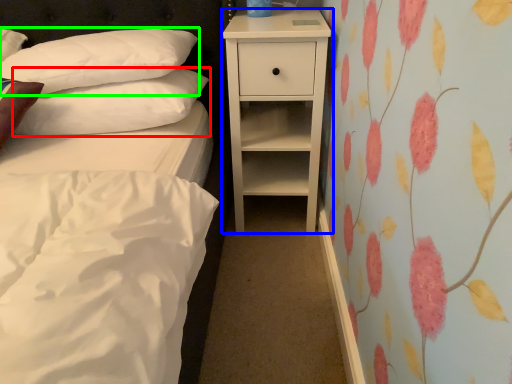
Question: Estimate the real-world distances between objects in this image. Which object is farther from pillow (highlighted by a red box), nightstand (highlighted by a blue box) or pillow (highlighted by a green box)?

Choices:
 (A) nightstand
 (B) pillow

Answer: (A)